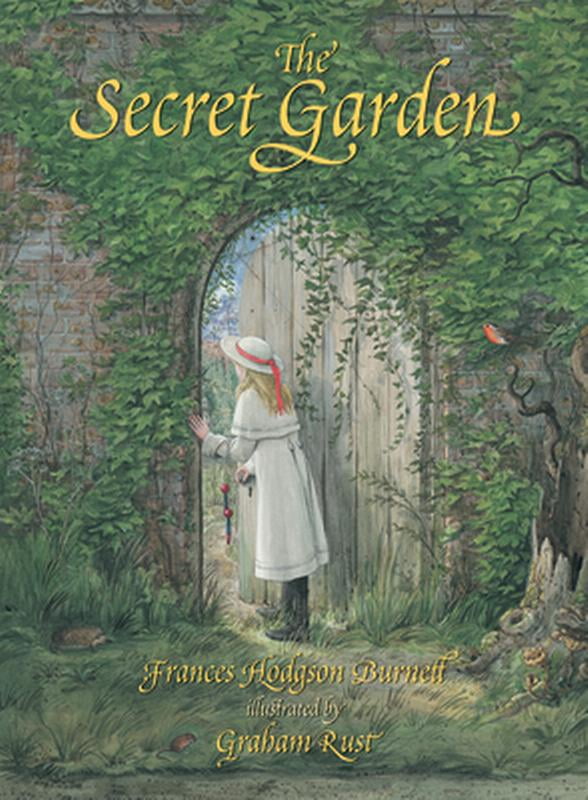
You are a GUI agent. You are given a task and a screenshot of the screen. Output one action in this format:
    pyautogui.click(x=<x>, y=<y>)
    Task: Click on the wall
    The height and width of the screenshot is (800, 588).
    Given the screenshot: What is the action you would take?
    pyautogui.click(x=69, y=314)